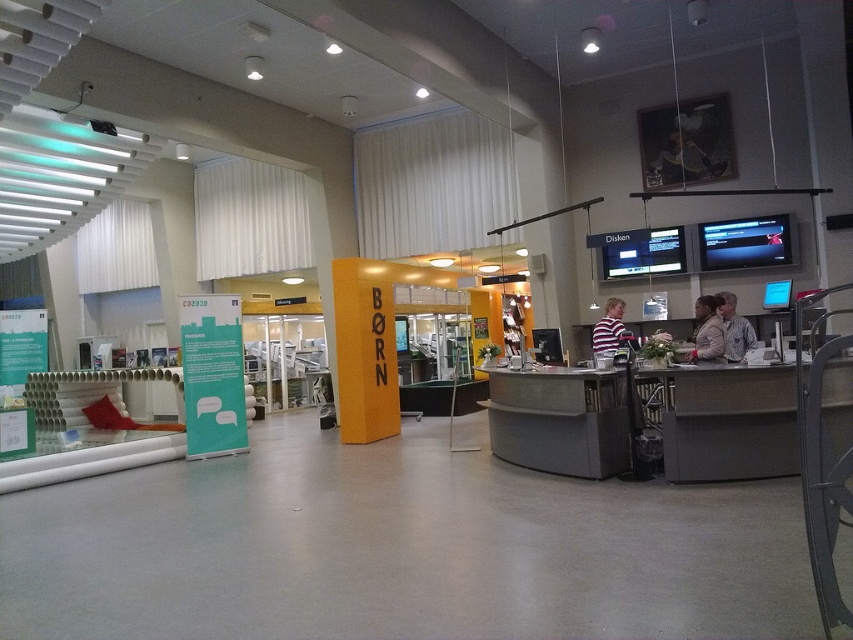
Describe the element at coordinates (560, 420) in the screenshot. I see `matte gray desk at center` at that location.

Who is lower down, matte gray desk at center or striped fabric shirt at center?

matte gray desk at center

Locate an element on the screen. The image size is (853, 640). matte gray desk at center is located at coordinates (560, 420).

Based on the photo, which is more to the left, matte gray desk at center or leather jacket at center?

matte gray desk at center

Who is taller, matte gray desk at center or leather jacket at center?

matte gray desk at center is taller.

Where is `matte gray desk at center`? The width and height of the screenshot is (853, 640). matte gray desk at center is located at coordinates (560, 420).

Does metallic gray desk at center have a greater height compared to matte gray desk at center?

No, metallic gray desk at center is not taller than matte gray desk at center.

Who is more forward, (686,465) or (554,392)?

Point (686,465) is more forward.

You are a GUI agent. You are given a task and a screenshot of the screen. Output one action in this format:
    pyautogui.click(x=<x>, y=<y>)
    Task: Click on the metallic gray desk at center
    The width and height of the screenshot is (853, 640).
    Given the screenshot: What is the action you would take?
    pyautogui.click(x=724, y=420)